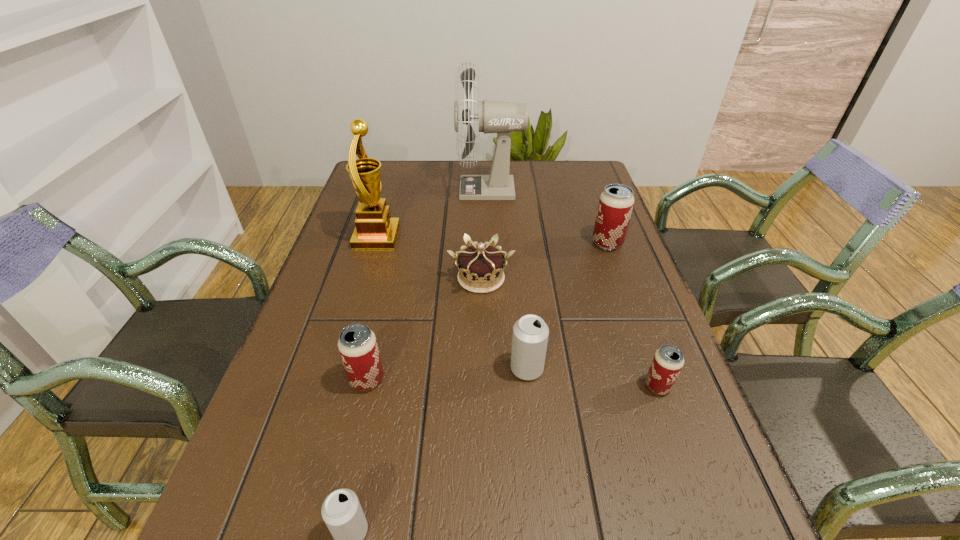
The height and width of the screenshot is (540, 960). In order to click on the smallest red beer can in this screenshot , I will do `click(668, 360)`.

This screenshot has height=540, width=960. Identify the location of vacant space located on the air flow direction of the farthest object. (396, 190).

This screenshot has height=540, width=960. Find the location of `vacant position located 0.070m on the air flow direction of the farthest object`. vacant position located 0.070m on the air flow direction of the farthest object is located at coordinates (436, 190).

Find the location of a particular element. This screenshot has height=540, width=960. vacant point located 0.250m on the air flow direction of the farthest object is located at coordinates (381, 190).

The height and width of the screenshot is (540, 960). I want to click on free space located on the front-facing side of the award, so click(x=454, y=237).

Identify the location of vacant space located 0.140m on the front of the farthest beer can. The width and height of the screenshot is (960, 540). (623, 288).

This screenshot has height=540, width=960. Identify the location of vacant space located 0.400m on the left of the farther white beer can. (314, 369).

Image resolution: width=960 pixels, height=540 pixels. In order to click on vacant space located 0.220m on the back of the second smallest red beer can in this screenshot , I will do `click(387, 293)`.

I want to click on vacant area situated on the right of the crown, so click(641, 278).

Where is `free point located 0.050m on the left of the smallest red beer can`? free point located 0.050m on the left of the smallest red beer can is located at coordinates (619, 386).